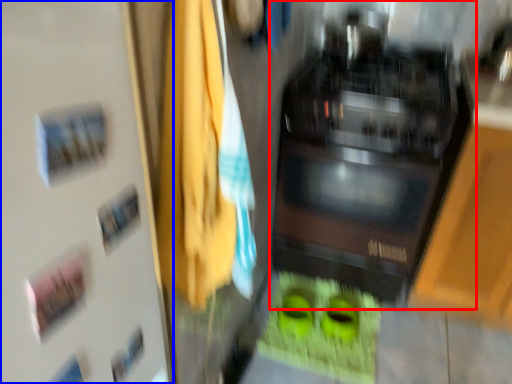
Question: Which of the following is the closest to the observer, home appliance (highlighted by a red box) or door (highlighted by a blue box)?

Choices:
 (A) home appliance
 (B) door

Answer: (B)